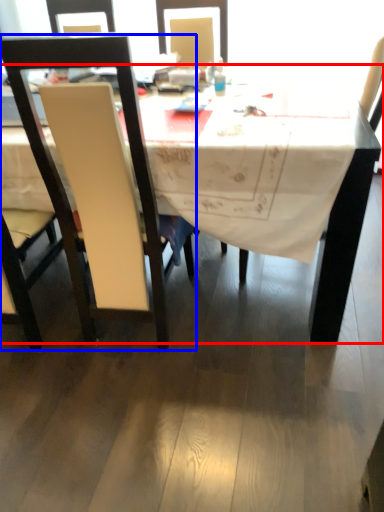
Question: Which of the following is the farthest to the observer, desk (highlighted by a red box) or chair (highlighted by a blue box)?

Choices:
 (A) desk
 (B) chair

Answer: (A)